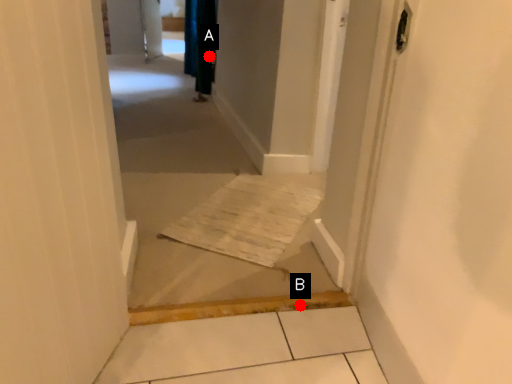
Question: Two points are circled on the image, labeled by A and B beside each circle. Which point appears closest to the camera in this image?

Choices:
 (A) A is closer
 (B) B is closer

Answer: (B)